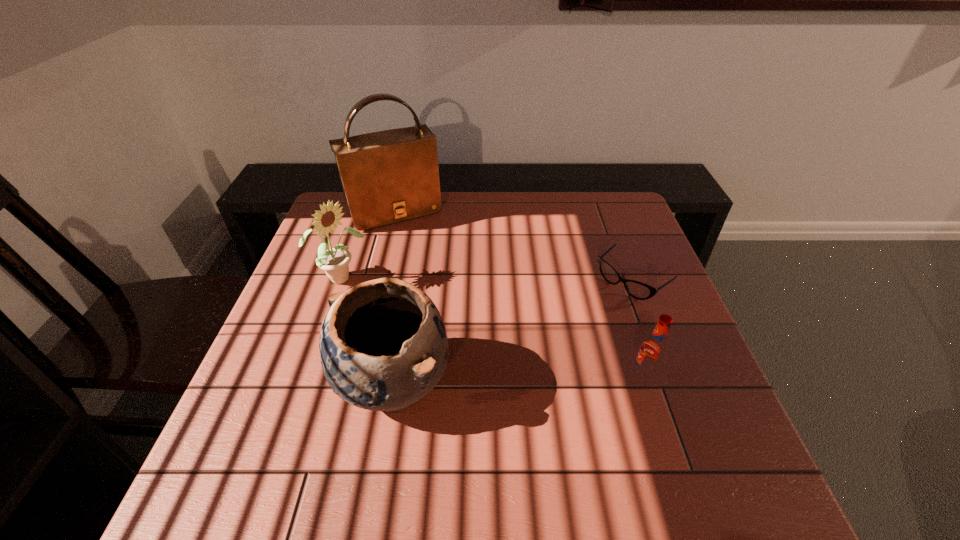
I want to click on sunflower present at the left edge, so click(334, 261).

Image resolution: width=960 pixels, height=540 pixels. I want to click on root beer situated at the right edge, so click(x=653, y=351).

I want to click on spectacles located in the right edge section of the desktop, so click(638, 290).

Locate an element on the screen. The height and width of the screenshot is (540, 960). object that is at the far left corner is located at coordinates (390, 176).

In the image, there is a desktop. Identify the location of vacant space at the far edge. (558, 214).

Identify the location of free space at the near edge. (418, 428).

This screenshot has height=540, width=960. In the image, there is a desktop. What are the coordinates of `vacant space at the left edge` in the screenshot? It's located at 292,348.

The width and height of the screenshot is (960, 540). In order to click on vacant space at the near left corner of the desktop in this screenshot , I will do `click(301, 440)`.

Where is `free space at the far right corner of the desktop`? free space at the far right corner of the desktop is located at coordinates (594, 213).

In the image, there is a desktop. Identify the location of vacant space at the near right corner. The width and height of the screenshot is (960, 540). (725, 436).